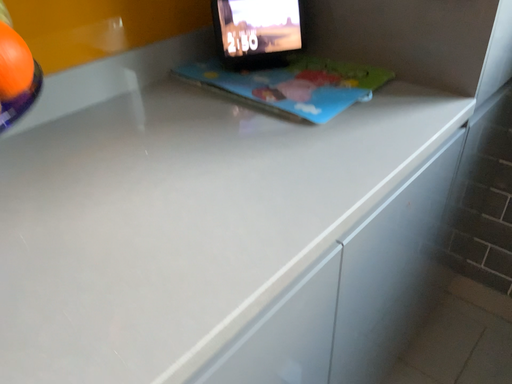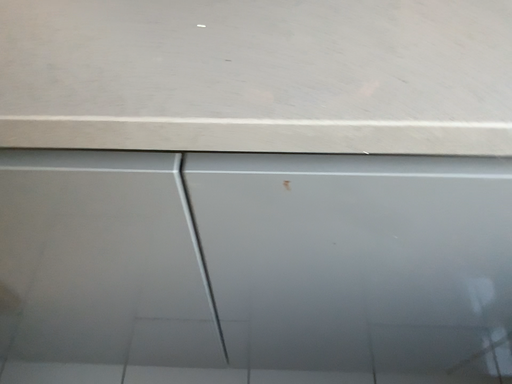
Question: How did the camera likely rotate when shooting the video?

Choices:
 (A) rotated upward
 (B) rotated downward

Answer: (B)